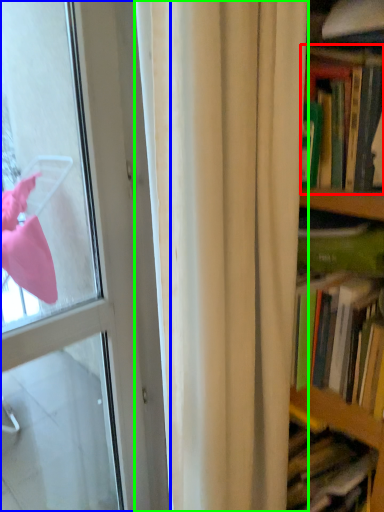
Question: Which object is positioned farthest from book (highlighted by a red box)? Select from door (highlighted by a blue box) and curtain (highlighted by a green box).

Choices:
 (A) door
 (B) curtain

Answer: (A)